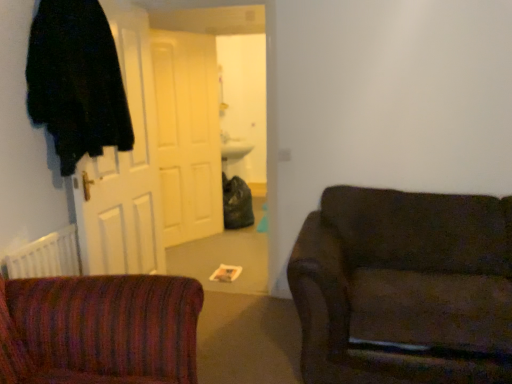
Question: Is point (162, 158) closer or farther from the camera than point (100, 226)?

Choices:
 (A) farther
 (B) closer

Answer: (A)

Question: From the image's perspective, is white matte door at center, which is the first door from back to front, above or below white wooden door at left, positioned as the 1th door in front-to-back order?

Choices:
 (A) below
 (B) above

Answer: (B)

Question: Estimate the real-world distances between objects in this image. Which object is closer to the dark brown fabric couch at right?

Choices:
 (A) white wooden door at left, positioned as the 1th door in front-to-back order
 (B) white matte door at center, which is the first door from back to front
 (C) black fuzzy robe at left

Answer: (A)

Question: Based on their relative distances, which object is nearer to the white matte door at center, which is the 2th door from front to back?

Choices:
 (A) white wooden door at left, positioned as the 1th door in front-to-back order
 (B) black fuzzy robe at left
 (C) dark brown fabric couch at right

Answer: (A)